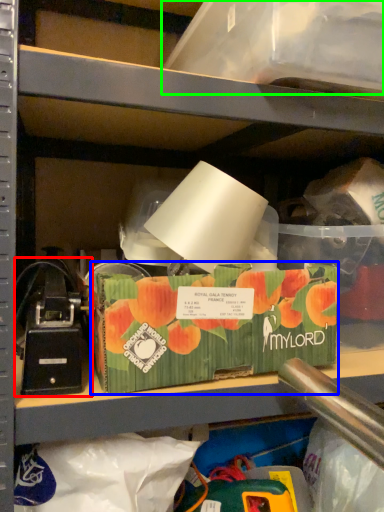
Question: Which object is positioned closest to toy (highlighted by a red box)? Select from storage box (highlighted by a blue box) and storage box (highlighted by a green box).

Choices:
 (A) storage box
 (B) storage box

Answer: (A)